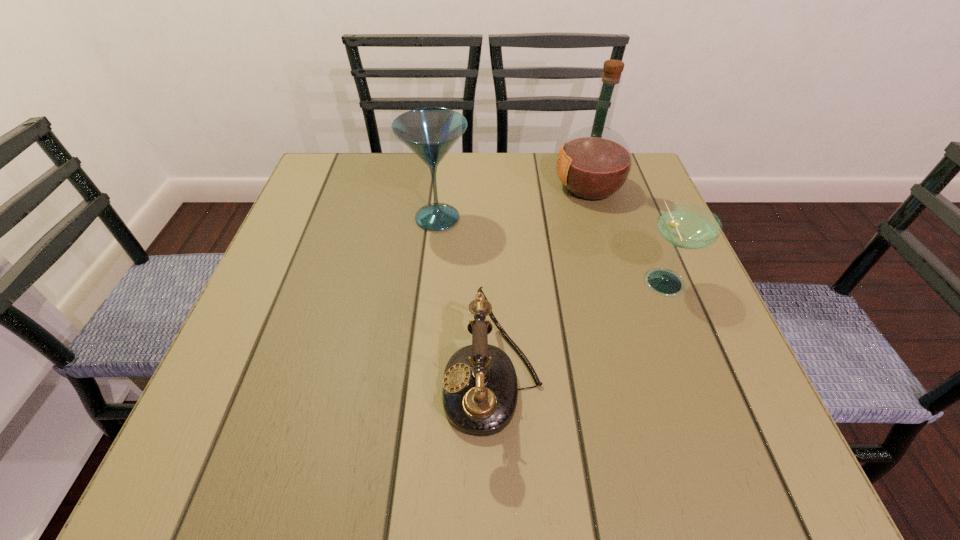
You are a GUI agent. You are given a task and a screenshot of the screen. Output one action in this format:
    pyautogui.click(x=<x>, y=<y>)
    Task: Click on the vacant region located 0.160m on the left of the second nearest object
    This screenshot has height=540, width=960.
    Given the screenshot: What is the action you would take?
    pyautogui.click(x=556, y=280)

Image resolution: width=960 pixels, height=540 pixels. Identify the location of vacant position located 0.240m on the dial of the nearest object. (295, 383).

Image resolution: width=960 pixels, height=540 pixels. I want to click on blank space located 0.350m on the dial of the nearest object, so click(x=227, y=383).

I want to click on vacant space located 0.370m on the dial of the nearest object, so click(x=214, y=383).

This screenshot has width=960, height=540. I want to click on liquor that is positioned at the far edge, so click(594, 163).

This screenshot has width=960, height=540. Identify the location of martini positioned at the far edge. (430, 132).

The height and width of the screenshot is (540, 960). Identify the location of object at the near edge. (480, 391).

Identify the location of liquor located in the right edge section of the desktop. The height and width of the screenshot is (540, 960). (594, 163).

Find the location of `martini located at the right edge`. martini located at the right edge is located at coordinates (687, 226).

You are a GUI agent. You are given a task and a screenshot of the screen. Output one action in this format:
    pyautogui.click(x=<x>, y=<y>)
    Task: Click on the object at the far right corner
    This screenshot has width=960, height=540.
    Given the screenshot: What is the action you would take?
    pyautogui.click(x=594, y=163)